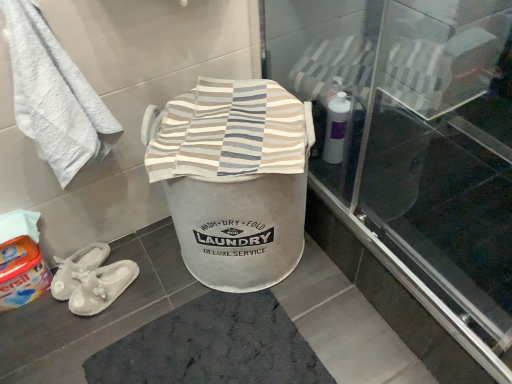
This screenshot has height=384, width=512. I want to click on free space in front of white fabric slippers at lower left, so click(92, 335).